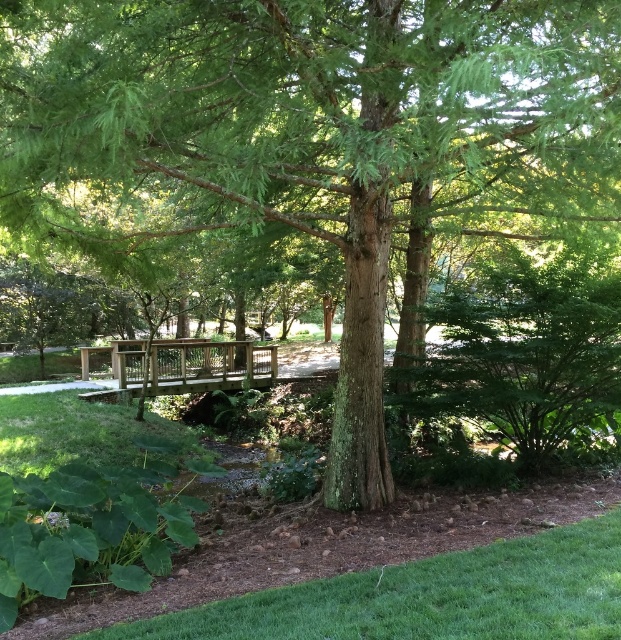
Question: Which object appears closest to the camera in this image?

Choices:
 (A) wooden bridge at center
 (B) green grass at lower right

Answer: (B)

Question: Observing the image, what is the correct spatial positioning of green grass at lower right in reference to wooden bridge at center?

Choices:
 (A) right
 (B) left

Answer: (A)

Question: Which object is farther from the camera taking this photo?

Choices:
 (A) green grass at lower right
 (B) wooden bridge at center

Answer: (B)

Question: Can you confirm if green grass at lower right is bigger than wooden bridge at center?

Choices:
 (A) no
 (B) yes

Answer: (A)

Question: Is green grass at lower right below wooden bridge at center?

Choices:
 (A) no
 (B) yes

Answer: (B)